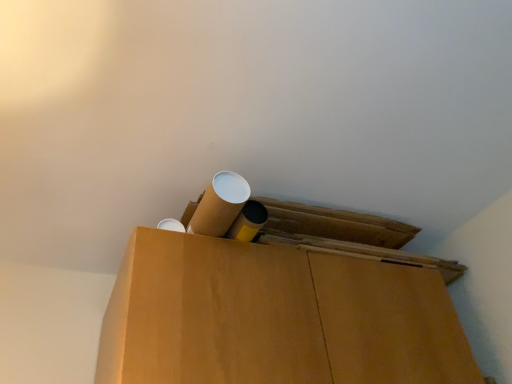
Identify the location of cardboard tube at upper center, the first wide positioned from the top. tap(336, 224).

What do you see at coordinates (336, 224) in the screenshot? I see `cardboard tube at upper center, the first wide positioned from the top` at bounding box center [336, 224].

Measure the distance between cardboard box at center, the second wide when ordered from top to bottom, and camera.

cardboard box at center, the second wide when ordered from top to bottom, is 1.11 meters from camera.

How much space does cardboard box at center, which appears as the first wide when ordered from the bottom, occupy vertically?

4.03 inches.

What do you see at coordinates (347, 235) in the screenshot? This screenshot has width=512, height=384. I see `cardboard box at center, the second wide when ordered from top to bottom` at bounding box center [347, 235].

At what (x,y) coordinates should I click in order to perform the action: click on cardboard box at center, the second wide when ordered from top to bottom. Please return your answer as a coordinate pair (x, y). The width and height of the screenshot is (512, 384). Looking at the image, I should click on (x=347, y=235).

The image size is (512, 384). What are the coordinates of `cardboard tube at upper center, which appears as the second wide when ordered from the bottom` in the screenshot? It's located at (336, 224).

Can you confirm if cardboard box at center, the second wide when ordered from top to bottom, is positioned to the right of cardboard tube at upper center, the first wide positioned from the top?

Indeed, cardboard box at center, the second wide when ordered from top to bottom, is positioned on the right side of cardboard tube at upper center, the first wide positioned from the top.

Is the depth of cardboard box at center, which appears as the first wide when ordered from the bottom, less than that of cardboard tube at upper center, the first wide positioned from the top?

That is True.

Is point (264, 240) closer or farther from the camera than point (386, 225)?

Clearly, point (264, 240) is closer to the camera than point (386, 225).

From the image's perspective, is cardboard box at center, which appears as the first wide when ordered from the bottom, above cardboard tube at upper center, the first wide positioned from the top?

No, from the image's perspective, cardboard box at center, which appears as the first wide when ordered from the bottom, is not above cardboard tube at upper center, the first wide positioned from the top.

From a real-world perspective, is cardboard box at center, the second wide when ordered from top to bottom, positioned under cardboard tube at upper center, which appears as the second wide when ordered from the bottom, based on gravity?

Indeed, from a real-world perspective, cardboard box at center, the second wide when ordered from top to bottom, is positioned beneath cardboard tube at upper center, which appears as the second wide when ordered from the bottom.

Which of these two, cardboard box at center, which appears as the first wide when ordered from the bottom, or cardboard tube at upper center, the first wide positioned from the top, is thinner?

cardboard tube at upper center, the first wide positioned from the top.

Does cardboard box at center, the second wide when ordered from top to bottom, have a lesser height compared to cardboard tube at upper center, which appears as the second wide when ordered from the bottom?

No, cardboard box at center, the second wide when ordered from top to bottom, is not shorter than cardboard tube at upper center, which appears as the second wide when ordered from the bottom.

Between cardboard box at center, which appears as the first wide when ordered from the bottom, and cardboard tube at upper center, which appears as the second wide when ordered from the bottom, which one has smaller size?

cardboard tube at upper center, which appears as the second wide when ordered from the bottom.

Is cardboard box at center, which appears as the first wide when ordered from the bottom, not within cardboard tube at upper center, the first wide positioned from the top?

Yes.

Is cardboard box at center, the second wide when ordered from top to bottom, placed right next to cardboard tube at upper center, the first wide positioned from the top?

Yes, cardboard box at center, the second wide when ordered from top to bottom, is beside cardboard tube at upper center, the first wide positioned from the top.

Is cardboard box at center, the second wide when ordered from top to bottom, aimed at cardboard tube at upper center, the first wide positioned from the top?

No.

Identify the location of wide above the cardboard box at center, which appears as the first wide when ordered from the bottom (from a real-world perspective). (336, 224).

Considering the positions of objects cardboard tube at upper center, which appears as the second wide when ordered from the bottom, and cardboard box at center, which appears as the first wide when ordered from the bottom, in the image provided, who is more to the left, cardboard tube at upper center, which appears as the second wide when ordered from the bottom, or cardboard box at center, which appears as the first wide when ordered from the bottom,?

From the viewer's perspective, cardboard tube at upper center, which appears as the second wide when ordered from the bottom, appears more on the left side.

Relative to cardboard box at center, the second wide when ordered from top to bottom, is cardboard tube at upper center, which appears as the second wide when ordered from the bottom, in front or behind?

Clearly, cardboard tube at upper center, which appears as the second wide when ordered from the bottom, is behind cardboard box at center, the second wide when ordered from top to bottom.

Considering the positions of point (393, 241) and point (298, 204), is point (393, 241) closer or farther from the camera than point (298, 204)?

Point (393, 241).

From the image's perspective, which is below, cardboard tube at upper center, the first wide positioned from the top, or cardboard box at center, which appears as the first wide when ordered from the bottom?

cardboard box at center, which appears as the first wide when ordered from the bottom, is shown below in the image.

Looking at this image, from a real-world perspective, between cardboard tube at upper center, the first wide positioned from the top, and cardboard box at center, which appears as the first wide when ordered from the bottom, who is vertically higher?

cardboard tube at upper center, the first wide positioned from the top.

Between cardboard tube at upper center, the first wide positioned from the top, and cardboard box at center, which appears as the first wide when ordered from the bottom, which one has smaller width?

With smaller width is cardboard tube at upper center, the first wide positioned from the top.

In the scene shown: Between cardboard tube at upper center, the first wide positioned from the top, and cardboard box at center, the second wide when ordered from top to bottom, which one has more height?

With more height is cardboard box at center, the second wide when ordered from top to bottom.

Is cardboard tube at upper center, which appears as the second wide when ordered from the bottom, bigger than cardboard box at center, which appears as the first wide when ordered from the bottom?

No, cardboard tube at upper center, which appears as the second wide when ordered from the bottom, is not bigger than cardboard box at center, which appears as the first wide when ordered from the bottom.

Can cardboard box at center, which appears as the first wide when ordered from the bottom, be found inside cardboard tube at upper center, the first wide positioned from the top?

Definitely not — cardboard box at center, which appears as the first wide when ordered from the bottom, is not inside cardboard tube at upper center, the first wide positioned from the top.

From the picture: Is cardboard tube at upper center, the first wide positioned from the top, far away from cardboard box at center, the second wide when ordered from top to bottom?

They are positioned close to each other.

From the picture: Is cardboard tube at upper center, the first wide positioned from the top, positioned with its back to cardboard box at center, the second wide when ordered from top to bottom?

cardboard tube at upper center, the first wide positioned from the top, is not turned away from cardboard box at center, the second wide when ordered from top to bottom.

How different are the orientations of cardboard tube at upper center, the first wide positioned from the top, and cardboard box at center, which appears as the first wide when ordered from the bottom, in degrees?

The angle between the facing direction of cardboard tube at upper center, the first wide positioned from the top, and the facing direction of cardboard box at center, which appears as the first wide when ordered from the bottom, is 0.000714 degrees.

Locate an element on the screen. The height and width of the screenshot is (384, 512). wide that is above the cardboard box at center, which appears as the first wide when ordered from the bottom (from a real-world perspective) is located at coordinates (336, 224).

Identify the location of wide below the cardboard tube at upper center, which appears as the second wide when ordered from the bottom (from the image's perspective). The image size is (512, 384). (347, 235).

Locate an element on the screen. The image size is (512, 384). wide in front of the cardboard tube at upper center, which appears as the second wide when ordered from the bottom is located at coordinates (347, 235).